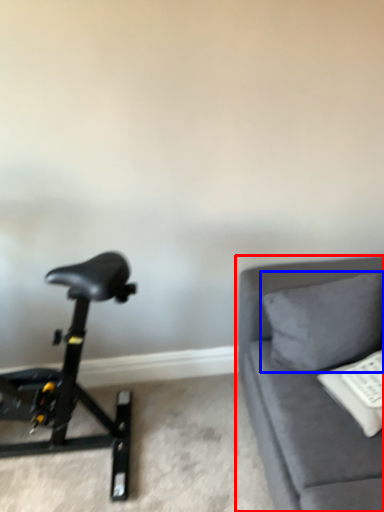
Question: Which of the following is the closest to the observer, studio couch (highlighted by a red box) or pillow (highlighted by a blue box)?

Choices:
 (A) studio couch
 (B) pillow

Answer: (A)